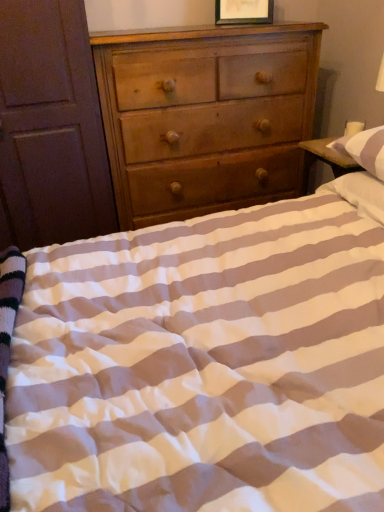
The image size is (384, 512). I want to click on white striped pillow at upper right, so click(x=359, y=193).

You are a GUI agent. You are given a task and a screenshot of the screen. Output one action in this format:
    pyautogui.click(x=<x>, y=<y>)
    Task: Click on the light brown wood chest of drawers at center
    This screenshot has width=384, height=512.
    Given the screenshot: What is the action you would take?
    pyautogui.click(x=206, y=116)

This screenshot has width=384, height=512. Describe the element at coordinates (50, 127) in the screenshot. I see `brown wooden armoire at left` at that location.

What is the approximate width of brown wooden armoire at left?

23.25 inches.

What do you see at coordinates (243, 12) in the screenshot? I see `wooden picture frame at upper center` at bounding box center [243, 12].

Locate an element on the screen. The width and height of the screenshot is (384, 512). white striped pillow at upper right is located at coordinates (359, 193).

Is light brown wood chest of drawers at center placed right next to white striped pillow at upper right?

No.

How many degrees apart are the facing directions of light brown wood chest of drawers at center and white striped pillow at upper right?

The angle between the facing direction of light brown wood chest of drawers at center and the facing direction of white striped pillow at upper right is 91.6 degrees.

From a real-world perspective, is light brown wood chest of drawers at center on white striped pillow at upper right?

Yes, from a real-world perspective, light brown wood chest of drawers at center is above white striped pillow at upper right.

This screenshot has height=512, width=384. I want to click on chest of drawers located on the left of white striped pillow at upper right, so click(x=206, y=116).

Is light brown wood chest of drawers at center located outside brown wooden armoire at left?

Yes, light brown wood chest of drawers at center is outside of brown wooden armoire at left.

Which of these two, light brown wood chest of drawers at center or brown wooden armoire at left, stands taller?

Standing taller between the two is brown wooden armoire at left.

Who is bigger, light brown wood chest of drawers at center or brown wooden armoire at left?

light brown wood chest of drawers at center.

From a real-world perspective, is brown wooden armoire at left positioned under light brown wood chest of drawers at center based on gravity?

No, from a real-world perspective, brown wooden armoire at left is not under light brown wood chest of drawers at center.

Considering the positions of objects brown wooden armoire at left and light brown wood chest of drawers at center in the image provided, who is more to the right, brown wooden armoire at left or light brown wood chest of drawers at center?

light brown wood chest of drawers at center.

Who is smaller, brown wooden armoire at left or light brown wood chest of drawers at center?

Smaller between the two is brown wooden armoire at left.

Is white striped pillow at upper right touching brown wooden armoire at left?

No, white striped pillow at upper right is not with brown wooden armoire at left.

Considering the sizes of white striped pillow at upper right and brown wooden armoire at left in the image, is white striped pillow at upper right wider or thinner than brown wooden armoire at left?

In the image, white striped pillow at upper right appears to be more narrow than brown wooden armoire at left.

Which object is further away from the camera, white striped pillow at upper right or brown wooden armoire at left?

brown wooden armoire at left is further from the camera.

From the image's perspective, is white striped pillow at upper right located above brown wooden armoire at left?

Actually, white striped pillow at upper right appears below brown wooden armoire at left in the image.

Is point (153, 39) closer to viewer compared to point (221, 4)?

Yes, point (153, 39) is closer to viewer.

From the picture: Visually, is light brown wood chest of drawers at center positioned to the left or to the right of wooden picture frame at upper center?

From the image, it's evident that light brown wood chest of drawers at center is to the left of wooden picture frame at upper center.

Would you say light brown wood chest of drawers at center is a long distance from wooden picture frame at upper center?

No, light brown wood chest of drawers at center is not far away from wooden picture frame at upper center.

How many degrees apart are the facing directions of light brown wood chest of drawers at center and wooden picture frame at upper center?

23.3 degrees.

Is brown wooden armoire at left at the back of wooden picture frame at upper center?

wooden picture frame at upper center is not turned away from brown wooden armoire at left.

Is wooden picture frame at upper center to the right of brown wooden armoire at left from the viewer's perspective?

Correct, you'll find wooden picture frame at upper center to the right of brown wooden armoire at left.

Is the depth of wooden picture frame at upper center greater than that of brown wooden armoire at left?

That is True.

From the image's perspective, relative to brown wooden armoire at left, is wooden picture frame at upper center above or below?

wooden picture frame at upper center is situated higher than brown wooden armoire at left in the image.

Is white striped pillow at upper right thinner than light brown wood chest of drawers at center?

Correct, the width of white striped pillow at upper right is less than that of light brown wood chest of drawers at center.

Consider the image. Between white striped pillow at upper right and light brown wood chest of drawers at center, which one appears on the right side from the viewer's perspective?

From the viewer's perspective, white striped pillow at upper right appears more on the right side.

From the image's perspective, is white striped pillow at upper right beneath light brown wood chest of drawers at center?

Yes.

Which of these two, white striped pillow at upper right or light brown wood chest of drawers at center, is smaller?

white striped pillow at upper right.

Locate an element on the screen. The width and height of the screenshot is (384, 512). pillow that is below the light brown wood chest of drawers at center (from the image's perspective) is located at coordinates (359, 193).

The image size is (384, 512). In order to click on armoire to the left of light brown wood chest of drawers at center in this screenshot , I will do `click(50, 127)`.

Consider the image. When comparing their distances from white striped pillow at upper right, does brown wooden armoire at left or light brown wood chest of drawers at center seem closer?

The object closer to white striped pillow at upper right is light brown wood chest of drawers at center.

Which object lies nearer to the anchor point wooden picture frame at upper center, brown wooden armoire at left or white striped pillow at upper right?

Among the two, brown wooden armoire at left is located nearer to wooden picture frame at upper center.

Which object lies nearer to the anchor point wooden picture frame at upper center, brown wooden armoire at left or light brown wood chest of drawers at center?

light brown wood chest of drawers at center.

Considering their positions, is brown wooden armoire at left positioned closer to light brown wood chest of drawers at center than white striped pillow at upper right?

brown wooden armoire at left is positioned closer to the anchor light brown wood chest of drawers at center.

Considering their positions, is white striped pillow at upper right positioned further to light brown wood chest of drawers at center than wooden picture frame at upper center?

Among the two, white striped pillow at upper right is located further to light brown wood chest of drawers at center.

Considering their positions, is white striped pillow at upper right positioned further to wooden picture frame at upper center than light brown wood chest of drawers at center?

white striped pillow at upper right is positioned further to the anchor wooden picture frame at upper center.

Looking at the image, which one is located further to white striped pillow at upper right, wooden picture frame at upper center or light brown wood chest of drawers at center?

wooden picture frame at upper center.

Considering their positions, is wooden picture frame at upper center positioned closer to white striped pillow at upper right than brown wooden armoire at left?

wooden picture frame at upper center lies closer to white striped pillow at upper right than the other object.

Where is `chest of drawers between brown wooden armoire at left and wooden picture frame at upper center from left to right`? chest of drawers between brown wooden armoire at left and wooden picture frame at upper center from left to right is located at coordinates (206, 116).

At what (x,y) coordinates should I click in order to perform the action: click on chest of drawers between brown wooden armoire at left and white striped pillow at upper right from left to right. Please return your answer as a coordinate pair (x, y). Looking at the image, I should click on (206, 116).

The height and width of the screenshot is (512, 384). Identify the location of picture frame situated between brown wooden armoire at left and white striped pillow at upper right from left to right. (243, 12).

Locate an element on the screen. the chest of drawers that lies between wooden picture frame at upper center and white striped pillow at upper right from top to bottom is located at coordinates (206, 116).